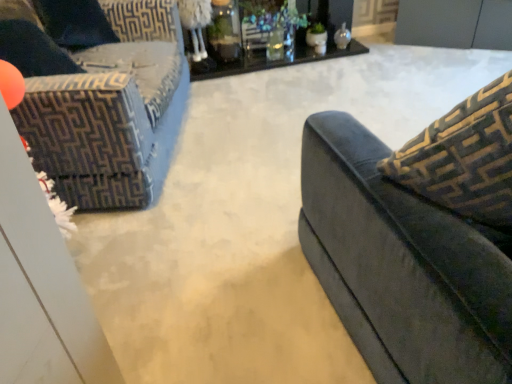
Question: Considering the relative sizes of velvet dark blue couch at left and black glass table at upper center in the image provided, is velvet dark blue couch at left smaller than black glass table at upper center?

Choices:
 (A) yes
 (B) no

Answer: (B)

Question: Does velvet dark blue couch at left appear on the left side of black glass table at upper center?

Choices:
 (A) no
 (B) yes

Answer: (B)

Question: Are velvet dark blue couch at left and black glass table at upper center beside each other?

Choices:
 (A) no
 (B) yes

Answer: (A)

Question: Is black glass table at upper center surrounded by velvet dark blue couch at left?

Choices:
 (A) no
 (B) yes

Answer: (A)

Question: Does velvet dark blue couch at left appear on the right side of black glass table at upper center?

Choices:
 (A) yes
 (B) no

Answer: (B)

Question: Does velvet dark blue couch at left have a larger size compared to black glass table at upper center?

Choices:
 (A) yes
 (B) no

Answer: (A)

Question: Could you tell me if black glass table at upper center is turned towards velvet dark blue couch at left?

Choices:
 (A) no
 (B) yes

Answer: (A)

Question: From the image's perspective, would you say black glass table at upper center is positioned over velvet dark blue couch at left?

Choices:
 (A) yes
 (B) no

Answer: (A)

Question: Is black glass table at upper center facing away from velvet dark blue couch at left?

Choices:
 (A) yes
 (B) no

Answer: (B)

Question: Is black glass table at upper center touching velvet dark blue couch at left?

Choices:
 (A) yes
 (B) no

Answer: (B)

Question: Considering the relative sizes of black glass table at upper center and velvet dark blue couch at left in the image provided, is black glass table at upper center shorter than velvet dark blue couch at left?

Choices:
 (A) no
 (B) yes

Answer: (B)

Question: Are black glass table at upper center and velvet dark blue couch at left located far from each other?

Choices:
 (A) yes
 (B) no

Answer: (A)

Question: From the image's perspective, is velvet dark blue couch at left located above or below black glass table at upper center?

Choices:
 (A) above
 (B) below

Answer: (B)